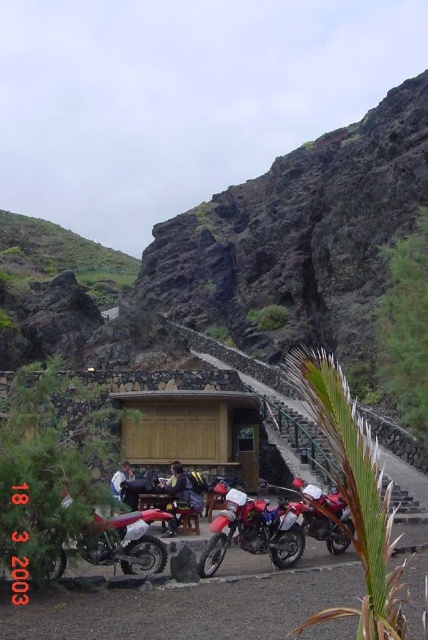
Who is shorter, red matte motorcycle at center or metallic red motorcycle at center?

metallic red motorcycle at center is shorter.

I want to click on red matte motorcycle at center, so click(252, 531).

Who is more forward, (121, 548) or (329, 540)?

Positioned in front is point (121, 548).

Is matte red motorcycle at lower left below metallic red motorcycle at center?

Yes.

Is point (145, 536) positioned before point (330, 548)?

Yes, point (145, 536) is closer to viewer.

The image size is (428, 640). Identify the location of matte red motorcycle at lower left. (125, 541).

Who is higher up, matte red motorcycle at lower left or light blue denim jacket at center?

Positioned higher is light blue denim jacket at center.

Can you confirm if matte red motorcycle at lower left is bigger than light blue denim jacket at center?

Actually, matte red motorcycle at lower left might be smaller than light blue denim jacket at center.

Image resolution: width=428 pixels, height=640 pixels. Identify the location of matte red motorcycle at lower left. (125, 541).